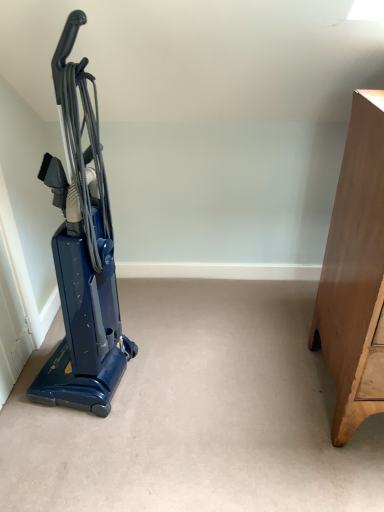
Question: Is there a large distance between blue glossy vacuum cleaner at left and light brown wooden dresser at right?

Choices:
 (A) no
 (B) yes

Answer: (A)

Question: Is blue glossy vacuum cleaner at left thinner than light brown wooden dresser at right?

Choices:
 (A) no
 (B) yes

Answer: (B)

Question: Is blue glossy vacuum cleaner at left closer to the viewer compared to light brown wooden dresser at right?

Choices:
 (A) no
 (B) yes

Answer: (A)

Question: Is blue glossy vacuum cleaner at left outside light brown wooden dresser at right?

Choices:
 (A) no
 (B) yes

Answer: (B)

Question: Is blue glossy vacuum cleaner at left surrounding light brown wooden dresser at right?

Choices:
 (A) yes
 (B) no

Answer: (B)

Question: Is blue glossy vacuum cleaner at left at the right side of light brown wooden dresser at right?

Choices:
 (A) no
 (B) yes

Answer: (A)

Question: Does light brown wooden dresser at right have a lesser width compared to blue glossy vacuum cleaner at left?

Choices:
 (A) no
 (B) yes

Answer: (A)

Question: From the image's perspective, is light brown wooden dresser at right on blue glossy vacuum cleaner at left?

Choices:
 (A) yes
 (B) no

Answer: (B)

Question: From a real-world perspective, does light brown wooden dresser at right stand above blue glossy vacuum cleaner at left?

Choices:
 (A) yes
 (B) no

Answer: (B)

Question: Is light brown wooden dresser at right further to camera compared to blue glossy vacuum cleaner at left?

Choices:
 (A) no
 (B) yes

Answer: (A)

Question: Is light brown wooden dresser at right placed right next to blue glossy vacuum cleaner at left?

Choices:
 (A) no
 (B) yes

Answer: (A)

Question: From the image's perspective, is light brown wooden dresser at right under blue glossy vacuum cleaner at left?

Choices:
 (A) yes
 (B) no

Answer: (A)

Question: In terms of height, does blue glossy vacuum cleaner at left look taller or shorter compared to light brown wooden dresser at right?

Choices:
 (A) tall
 (B) short

Answer: (A)